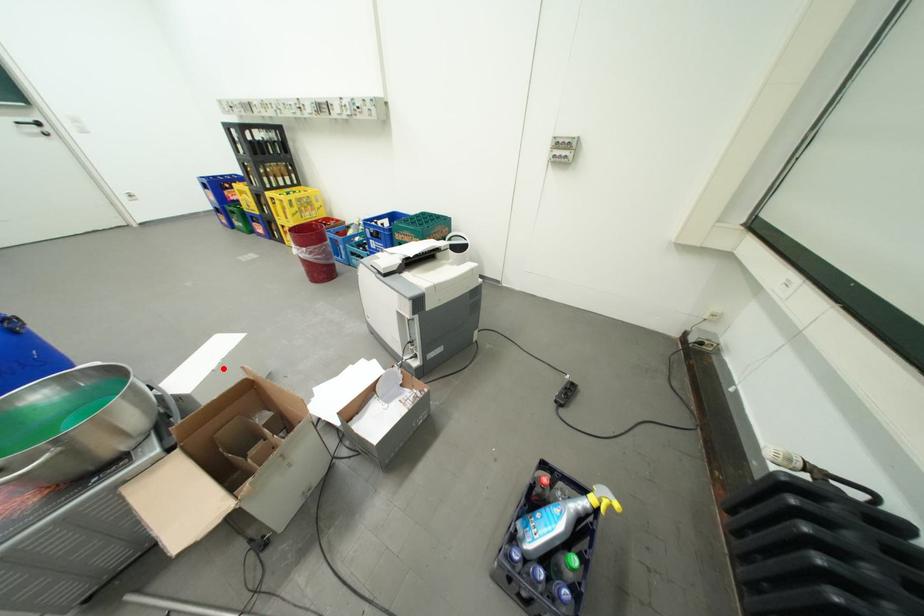
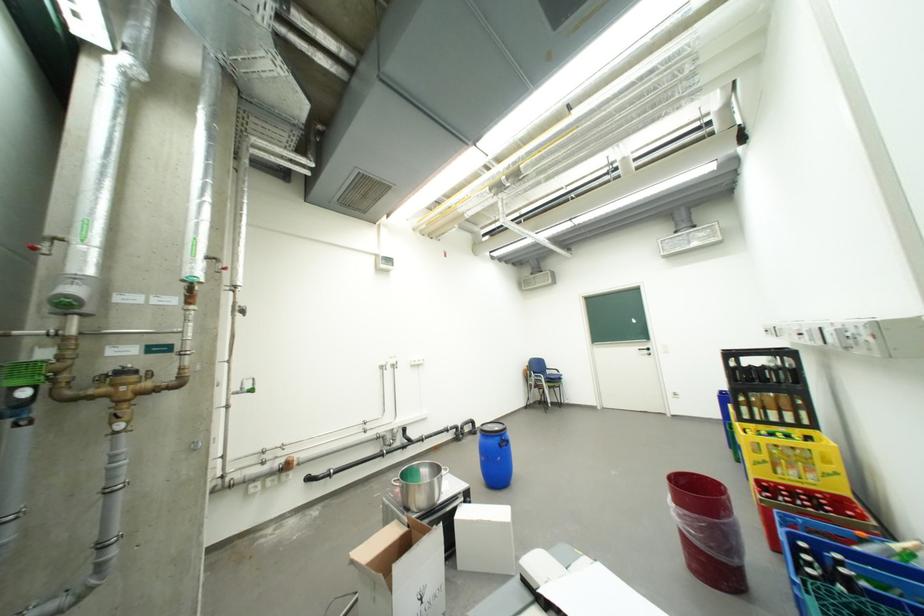
Locate, in the second image, the point that corresponds to the highlighted location in the first image.

(484, 520)